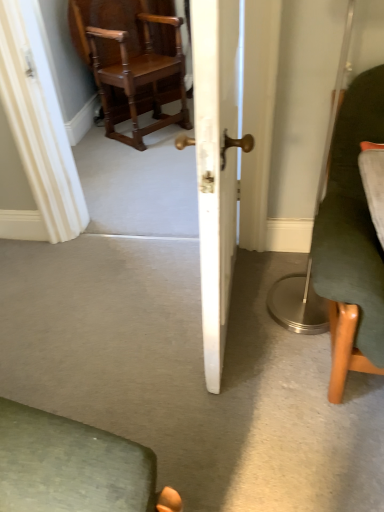
Question: Is white wood door at center turned away from dark green fabric chair at right, which is the second chair from back to front?

Choices:
 (A) no
 (B) yes

Answer: (B)

Question: Can we say white wood door at center lies outside dark green fabric chair at right, the 2th chair in the top-to-bottom sequence?

Choices:
 (A) no
 (B) yes

Answer: (B)

Question: Considering the relative sizes of white wood door at center and dark green fabric chair at right, the 2th chair in the left-to-right sequence, in the image provided, is white wood door at center bigger than dark green fabric chair at right, the 2th chair in the left-to-right sequence,?

Choices:
 (A) no
 (B) yes

Answer: (B)

Question: Is white wood door at center in contact with dark green fabric chair at right, arranged as the 1th chair when ordered from the bottom?

Choices:
 (A) no
 (B) yes

Answer: (A)

Question: Could you tell me if white wood door at center is turned towards dark green fabric chair at right, the 2th chair in the left-to-right sequence?

Choices:
 (A) no
 (B) yes

Answer: (B)

Question: From their relative heights in the image, would you say dark green fabric chair at right, the 1th chair viewed from the front, is taller or shorter than polished wood chair at upper left, positioned as the 1th chair in left-to-right order?

Choices:
 (A) short
 (B) tall

Answer: (A)

Question: From a real-world perspective, is dark green fabric chair at right, the 2th chair in the top-to-bottom sequence, positioned above or below polished wood chair at upper left, positioned as the 1th chair in left-to-right order?

Choices:
 (A) above
 (B) below

Answer: (A)

Question: Relative to polished wood chair at upper left, positioned as the 1th chair in left-to-right order, is dark green fabric chair at right, the 1th chair viewed from the front, in front or behind?

Choices:
 (A) front
 (B) behind

Answer: (A)

Question: Is dark green fabric chair at right, which is the first chair in right-to-left order, inside or outside of polished wood chair at upper left, the 2th chair when ordered from right to left?

Choices:
 (A) inside
 (B) outside

Answer: (B)

Question: From the image's perspective, relative to white wood door at center, is polished wood chair at upper left, arranged as the 2th chair when ordered from the bottom, above or below?

Choices:
 (A) above
 (B) below

Answer: (A)

Question: Is point (92, 36) closer or farther from the camera than point (200, 260)?

Choices:
 (A) closer
 (B) farther

Answer: (B)

Question: Would you say polished wood chair at upper left, positioned as the 1th chair in left-to-right order, is to the left or to the right of white wood door at center in the picture?

Choices:
 (A) left
 (B) right

Answer: (A)

Question: Looking at their shapes, would you say polished wood chair at upper left, positioned as the 1th chair in left-to-right order, is wider or thinner than white wood door at center?

Choices:
 (A) thin
 (B) wide

Answer: (B)

Question: Considering the positions of white wood door at center and polished wood chair at upper left, arranged as the 2th chair when ordered from the bottom, in the image, is white wood door at center bigger or smaller than polished wood chair at upper left, arranged as the 2th chair when ordered from the bottom,?

Choices:
 (A) big
 (B) small

Answer: (B)

Question: In the image, is white wood door at center positioned in front of or behind polished wood chair at upper left, arranged as the 2th chair when ordered from the bottom?

Choices:
 (A) front
 (B) behind

Answer: (A)